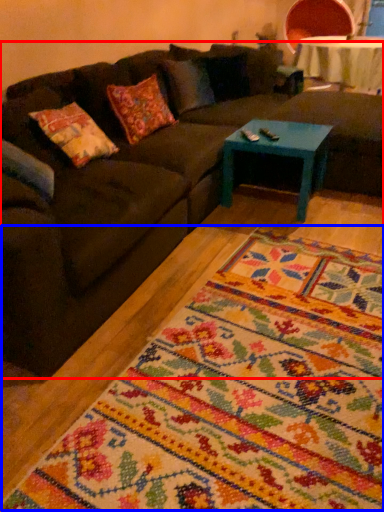
Question: Which object appears closest to the camera in this image, studio couch (highlighted by a red box) or mat (highlighted by a blue box)?

Choices:
 (A) studio couch
 (B) mat

Answer: (B)